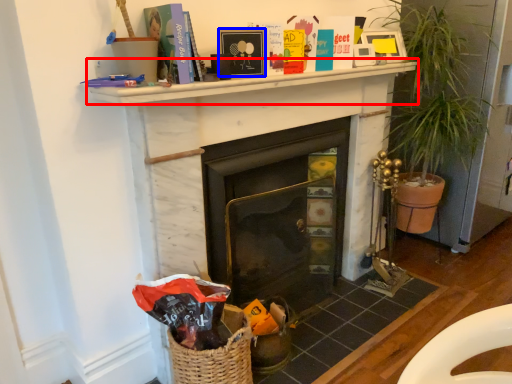
Question: Which of the following is the closest to the observer, mantle (highlighted by a red box) or picture frame (highlighted by a blue box)?

Choices:
 (A) mantle
 (B) picture frame

Answer: (A)